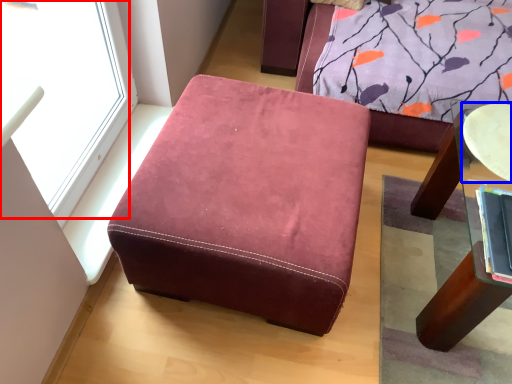
Question: Which point is closer to the camera, window (highlighted by a red box) or round table (highlighted by a blue box)?

Choices:
 (A) window
 (B) round table

Answer: (A)